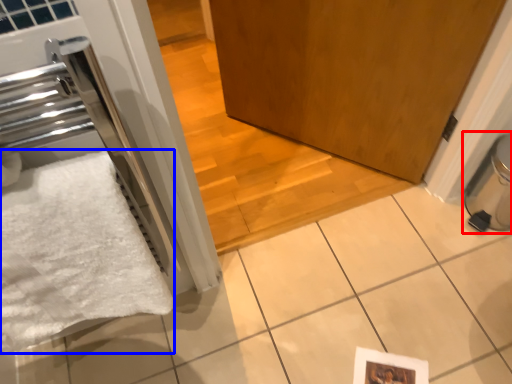
Question: Which of the following is the closest to the observer, water heater (highlighted by a red box) or bath towel (highlighted by a blue box)?

Choices:
 (A) water heater
 (B) bath towel

Answer: (B)